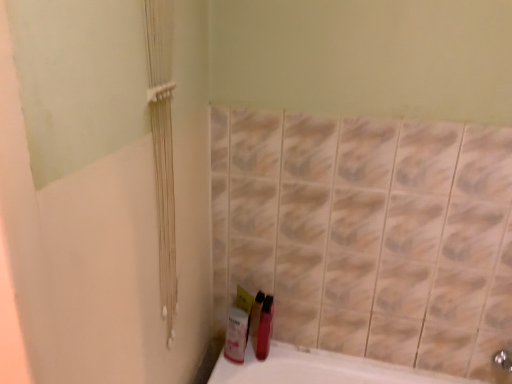
Find the location of `white glossy mouthwash at lower center, the second mouthwash positioned from the right`. white glossy mouthwash at lower center, the second mouthwash positioned from the right is located at coordinates (236, 335).

Image resolution: width=512 pixels, height=384 pixels. Describe the element at coordinates (236, 335) in the screenshot. I see `white glossy mouthwash at lower center, acting as the 1th mouthwash starting from the left` at that location.

You are a GUI agent. You are given a task and a screenshot of the screen. Output one action in this format:
    pyautogui.click(x=<x>, y=<y>)
    Task: Click on the shiny red plastic mouthwash at lower center, the 1th mouthwash when ordered from right to left
    The width and height of the screenshot is (512, 384).
    Given the screenshot: What is the action you would take?
    pyautogui.click(x=265, y=328)

The height and width of the screenshot is (384, 512). What do you see at coordinates (265, 328) in the screenshot?
I see `shiny red plastic mouthwash at lower center, acting as the 2th mouthwash starting from the left` at bounding box center [265, 328].

At what (x,y) coordinates should I click in order to perform the action: click on white glossy mouthwash at lower center, acting as the 1th mouthwash starting from the left. Please return your answer as a coordinate pair (x, y). Image resolution: width=512 pixels, height=384 pixels. Looking at the image, I should click on (236, 335).

Can you confirm if shiny red plastic mouthwash at lower center, acting as the 2th mouthwash starting from the left, is positioned to the left of white glossy mouthwash at lower center, acting as the 1th mouthwash starting from the left?

No.

Considering the relative positions of shiny red plastic mouthwash at lower center, the 1th mouthwash when ordered from right to left, and white glossy mouthwash at lower center, the second mouthwash positioned from the right, in the image provided, is shiny red plastic mouthwash at lower center, the 1th mouthwash when ordered from right to left, behind white glossy mouthwash at lower center, the second mouthwash positioned from the right,?

Yes, it is behind white glossy mouthwash at lower center, the second mouthwash positioned from the right.

Considering the points (266, 353) and (233, 316), which point is behind, point (266, 353) or point (233, 316)?

The point (266, 353) is more distant.

From the image's perspective, who appears lower, shiny red plastic mouthwash at lower center, acting as the 2th mouthwash starting from the left, or white glossy mouthwash at lower center, acting as the 1th mouthwash starting from the left?

white glossy mouthwash at lower center, acting as the 1th mouthwash starting from the left, from the image's perspective.

From a real-world perspective, is shiny red plastic mouthwash at lower center, acting as the 2th mouthwash starting from the left, located beneath white glossy mouthwash at lower center, acting as the 1th mouthwash starting from the left?

Incorrect, from a real-world perspective, shiny red plastic mouthwash at lower center, acting as the 2th mouthwash starting from the left, is higher than white glossy mouthwash at lower center, acting as the 1th mouthwash starting from the left.

Which object is wider, shiny red plastic mouthwash at lower center, the 1th mouthwash when ordered from right to left, or white glossy mouthwash at lower center, acting as the 1th mouthwash starting from the left?

Wider between the two is shiny red plastic mouthwash at lower center, the 1th mouthwash when ordered from right to left.

Considering the relative sizes of shiny red plastic mouthwash at lower center, acting as the 2th mouthwash starting from the left, and white glossy mouthwash at lower center, acting as the 1th mouthwash starting from the left, in the image provided, is shiny red plastic mouthwash at lower center, acting as the 2th mouthwash starting from the left, shorter than white glossy mouthwash at lower center, acting as the 1th mouthwash starting from the left,?

No.

Can you confirm if shiny red plastic mouthwash at lower center, acting as the 2th mouthwash starting from the left, is smaller than white glossy mouthwash at lower center, the second mouthwash positioned from the right?

Actually, shiny red plastic mouthwash at lower center, acting as the 2th mouthwash starting from the left, might be larger than white glossy mouthwash at lower center, the second mouthwash positioned from the right.

Would you say shiny red plastic mouthwash at lower center, acting as the 2th mouthwash starting from the left, is inside or outside white glossy mouthwash at lower center, the second mouthwash positioned from the right?

shiny red plastic mouthwash at lower center, acting as the 2th mouthwash starting from the left, is not inside white glossy mouthwash at lower center, the second mouthwash positioned from the right, it's outside.

Would you consider shiny red plastic mouthwash at lower center, the 1th mouthwash when ordered from right to left, to be distant from white glossy mouthwash at lower center, acting as the 1th mouthwash starting from the left?

No, shiny red plastic mouthwash at lower center, the 1th mouthwash when ordered from right to left, is in close proximity to white glossy mouthwash at lower center, acting as the 1th mouthwash starting from the left.

Is shiny red plastic mouthwash at lower center, the 1th mouthwash when ordered from right to left, aimed at white glossy mouthwash at lower center, acting as the 1th mouthwash starting from the left?

No, shiny red plastic mouthwash at lower center, the 1th mouthwash when ordered from right to left, is not aimed at white glossy mouthwash at lower center, acting as the 1th mouthwash starting from the left.

How different are the orientations of shiny red plastic mouthwash at lower center, the 1th mouthwash when ordered from right to left, and white glossy mouthwash at lower center, the second mouthwash positioned from the right, in degrees?

shiny red plastic mouthwash at lower center, the 1th mouthwash when ordered from right to left, and white glossy mouthwash at lower center, the second mouthwash positioned from the right, are facing 91.9 degrees away from each other.

Where is `mouthwash located in front of the shiny red plastic mouthwash at lower center, the 1th mouthwash when ordered from right to left`? mouthwash located in front of the shiny red plastic mouthwash at lower center, the 1th mouthwash when ordered from right to left is located at coordinates (236, 335).

Which object is positioned more to the left, white glossy mouthwash at lower center, the second mouthwash positioned from the right, or shiny red plastic mouthwash at lower center, acting as the 2th mouthwash starting from the left?

white glossy mouthwash at lower center, the second mouthwash positioned from the right, is more to the left.

Looking at this image, is the position of white glossy mouthwash at lower center, acting as the 1th mouthwash starting from the left, more distant than that of shiny red plastic mouthwash at lower center, acting as the 2th mouthwash starting from the left?

No, it is in front of shiny red plastic mouthwash at lower center, acting as the 2th mouthwash starting from the left.

Does point (232, 319) appear closer or farther from the camera than point (267, 318)?

Clearly, point (232, 319) is closer to the camera than point (267, 318).

From the image's perspective, would you say white glossy mouthwash at lower center, the second mouthwash positioned from the right, is shown under shiny red plastic mouthwash at lower center, acting as the 2th mouthwash starting from the left?

Yes, from the image's perspective, white glossy mouthwash at lower center, the second mouthwash positioned from the right, is below shiny red plastic mouthwash at lower center, acting as the 2th mouthwash starting from the left.

From a real-world perspective, is white glossy mouthwash at lower center, the second mouthwash positioned from the right, over shiny red plastic mouthwash at lower center, acting as the 2th mouthwash starting from the left?

No, from a real-world perspective, white glossy mouthwash at lower center, the second mouthwash positioned from the right, is not on top of shiny red plastic mouthwash at lower center, acting as the 2th mouthwash starting from the left.

Which object is thinner, white glossy mouthwash at lower center, the second mouthwash positioned from the right, or shiny red plastic mouthwash at lower center, acting as the 2th mouthwash starting from the left?

Thinner between the two is white glossy mouthwash at lower center, the second mouthwash positioned from the right.

From the picture: From their relative heights in the image, would you say white glossy mouthwash at lower center, acting as the 1th mouthwash starting from the left, is taller or shorter than shiny red plastic mouthwash at lower center, acting as the 2th mouthwash starting from the left?

In the image, white glossy mouthwash at lower center, acting as the 1th mouthwash starting from the left, appears to be shorter than shiny red plastic mouthwash at lower center, acting as the 2th mouthwash starting from the left.

Is white glossy mouthwash at lower center, the second mouthwash positioned from the right, smaller than shiny red plastic mouthwash at lower center, acting as the 2th mouthwash starting from the left?

Correct, white glossy mouthwash at lower center, the second mouthwash positioned from the right, occupies less space than shiny red plastic mouthwash at lower center, acting as the 2th mouthwash starting from the left.

Would you say shiny red plastic mouthwash at lower center, the 1th mouthwash when ordered from right to left, is part of white glossy mouthwash at lower center, acting as the 1th mouthwash starting from the left,'s contents?

That's incorrect, shiny red plastic mouthwash at lower center, the 1th mouthwash when ordered from right to left, is not inside white glossy mouthwash at lower center, acting as the 1th mouthwash starting from the left.

Is white glossy mouthwash at lower center, the second mouthwash positioned from the right, positioned far away from shiny red plastic mouthwash at lower center, the 1th mouthwash when ordered from right to left?

white glossy mouthwash at lower center, the second mouthwash positioned from the right, is near shiny red plastic mouthwash at lower center, the 1th mouthwash when ordered from right to left, not far away.

Is shiny red plastic mouthwash at lower center, acting as the 2th mouthwash starting from the left, at the back of white glossy mouthwash at lower center, the second mouthwash positioned from the right?

That's not correct — white glossy mouthwash at lower center, the second mouthwash positioned from the right, is not looking away from shiny red plastic mouthwash at lower center, acting as the 2th mouthwash starting from the left.

Looking at this image, measure the distance between white glossy mouthwash at lower center, acting as the 1th mouthwash starting from the left, and shiny red plastic mouthwash at lower center, acting as the 2th mouthwash starting from the left.

A distance of 2.97 inches exists between white glossy mouthwash at lower center, acting as the 1th mouthwash starting from the left, and shiny red plastic mouthwash at lower center, acting as the 2th mouthwash starting from the left.

The image size is (512, 384). What are the coordinates of `mouthwash in front of the shiny red plastic mouthwash at lower center, acting as the 2th mouthwash starting from the left` in the screenshot? It's located at (236, 335).

Find the location of `mouthwash to the left of shiny red plastic mouthwash at lower center, the 1th mouthwash when ordered from right to left`. mouthwash to the left of shiny red plastic mouthwash at lower center, the 1th mouthwash when ordered from right to left is located at coordinates (236, 335).

Where is `mouthwash below the shiny red plastic mouthwash at lower center, the 1th mouthwash when ordered from right to left (from a real-world perspective)`? This screenshot has width=512, height=384. mouthwash below the shiny red plastic mouthwash at lower center, the 1th mouthwash when ordered from right to left (from a real-world perspective) is located at coordinates (236, 335).